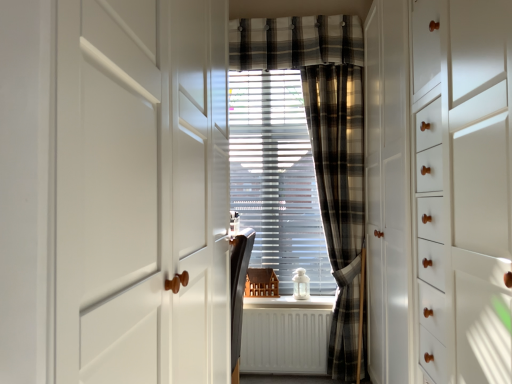
Question: Considering the relative sizes of white glossy window sill at center and matte black chair at center, the first furniture positioned from the front, in the image provided, is white glossy window sill at center wider than matte black chair at center, the first furniture positioned from the front,?

Choices:
 (A) no
 (B) yes

Answer: (B)

Question: Is white glossy window sill at center shorter than matte black chair at center, the first furniture positioned from the front?

Choices:
 (A) yes
 (B) no

Answer: (A)

Question: From the image's perspective, would you say white glossy window sill at center is shown under matte black chair at center, which ranks as the 2th furniture in back-to-front order?

Choices:
 (A) no
 (B) yes

Answer: (B)

Question: Is white glossy window sill at center bigger than matte black chair at center, the first furniture positioned from the front?

Choices:
 (A) yes
 (B) no

Answer: (B)

Question: Considering the relative sizes of white glossy window sill at center and matte black chair at center, the first furniture positioned from the front, in the image provided, is white glossy window sill at center smaller than matte black chair at center, the first furniture positioned from the front,?

Choices:
 (A) no
 (B) yes

Answer: (B)

Question: Is white glossy window sill at center taller than matte black chair at center, the first furniture positioned from the front?

Choices:
 (A) yes
 (B) no

Answer: (B)

Question: Can you confirm if wooden miniature house at center, marked as the 2th furniture in a front-to-back arrangement, is positioned to the left of white glossy window sill at center?

Choices:
 (A) yes
 (B) no

Answer: (A)

Question: Is wooden miniature house at center, the 1th furniture when ordered from back to front, facing away from white glossy window sill at center?

Choices:
 (A) yes
 (B) no

Answer: (B)

Question: Is wooden miniature house at center, the 1th furniture when ordered from back to front, thinner than white glossy window sill at center?

Choices:
 (A) yes
 (B) no

Answer: (A)

Question: From a real-world perspective, is wooden miniature house at center, marked as the 2th furniture in a front-to-back arrangement, positioned under white glossy window sill at center based on gravity?

Choices:
 (A) yes
 (B) no

Answer: (B)

Question: Is white glossy window sill at center inside wooden miniature house at center, marked as the 2th furniture in a front-to-back arrangement?

Choices:
 (A) yes
 (B) no

Answer: (B)

Question: Could you tell me if wooden miniature house at center, marked as the 2th furniture in a front-to-back arrangement, is turned towards white glossy window sill at center?

Choices:
 (A) no
 (B) yes

Answer: (A)

Question: Is plaid fabric curtain at center behind white matte radiator at center?

Choices:
 (A) no
 (B) yes

Answer: (A)